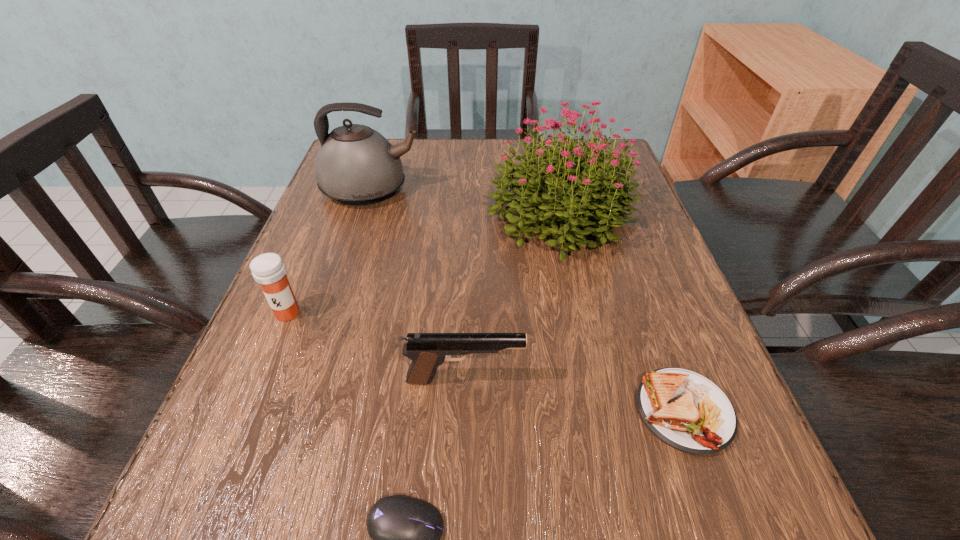
In the image, there is a desktop. Identify the location of free space at the left edge. The image size is (960, 540). (376, 228).

This screenshot has width=960, height=540. In the image, there is a desktop. Find the location of `vacant area at the far left corner`. vacant area at the far left corner is located at coordinates click(x=394, y=144).

Identify the location of free space at the near left corner of the desktop. This screenshot has height=540, width=960. (251, 514).

In order to click on vacant space at the near right corner in this screenshot , I will do `click(700, 524)`.

I want to click on free space between the pistol and the fifth tallest object, so click(x=574, y=395).

You are a GUI agent. You are given a task and a screenshot of the screen. Output one action in this format:
    pyautogui.click(x=<x>, y=<y>)
    Task: Click on the vacant point located between the pistol and the sandwich
    The image size is (960, 540).
    Given the screenshot: What is the action you would take?
    pyautogui.click(x=574, y=395)

Find the location of a particular element. The image size is (960, 540). empty space that is in between the pistol and the kettle is located at coordinates tap(419, 285).

In order to click on empty space between the second tallest object and the sandwich in this screenshot , I will do `click(528, 301)`.

The image size is (960, 540). I want to click on free space between the tallest object and the fourth nearest object, so click(x=424, y=265).

At what (x,y) coordinates should I click in order to perform the action: click on blank region between the pistol and the fifth shortest object. Please return your answer as a coordinate pair (x, y). The height and width of the screenshot is (540, 960). Looking at the image, I should click on (419, 285).